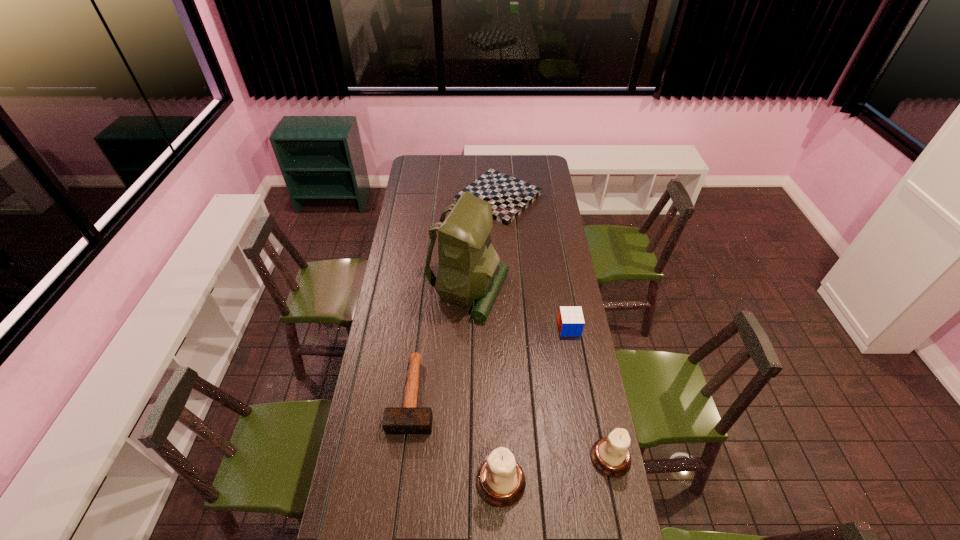
Where is `checkerboard that is at the right edge`? checkerboard that is at the right edge is located at coordinates point(509,197).

I want to click on cube positioned at the right edge, so pos(570,319).

At what (x,y) coordinates should I click in order to perform the action: click on object at the far right corner. Please return your answer as a coordinate pair (x, y). This screenshot has height=540, width=960. Looking at the image, I should click on (509, 197).

The height and width of the screenshot is (540, 960). I want to click on free space at the far edge, so click(x=451, y=175).

In the image, there is a desktop. Identify the location of blank space at the left edge. tap(424, 230).

The image size is (960, 540). In the image, there is a desktop. In order to click on vacant space at the far left corner in this screenshot , I will do `click(430, 157)`.

Where is `vacant space at the far right corner of the desktop`? vacant space at the far right corner of the desktop is located at coordinates (534, 161).

Where is `vacant region between the fourth tallest object and the fourth shortest object`? The width and height of the screenshot is (960, 540). vacant region between the fourth tallest object and the fourth shortest object is located at coordinates (589, 393).

I want to click on vacant space in between the fourth farthest object and the left candle holder, so click(x=457, y=438).

The image size is (960, 540). I want to click on empty space that is in between the checkerboard and the taller candle holder, so click(x=499, y=340).